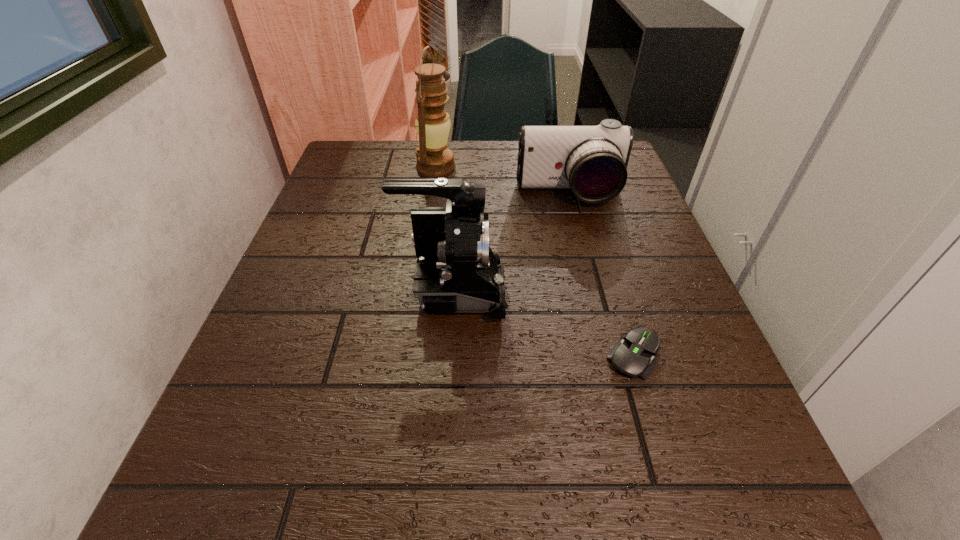
The height and width of the screenshot is (540, 960). Identify the location of the tallest object. (434, 159).

Find the location of a particular element. Image resolution: width=960 pixels, height=540 pixels. the third shortest object is located at coordinates (456, 269).

At what (x,y) coordinates should I click in order to perform the action: click on the second nearest object. Please return your answer as a coordinate pair (x, y). The width and height of the screenshot is (960, 540). Looking at the image, I should click on (456, 269).

Locate an element on the screen. This screenshot has width=960, height=540. the farther camcorder is located at coordinates (592, 161).

Locate an element on the screen. The width and height of the screenshot is (960, 540). the right camcorder is located at coordinates (592, 161).

Image resolution: width=960 pixels, height=540 pixels. In order to click on the shortest object in this screenshot , I will do `click(632, 356)`.

This screenshot has height=540, width=960. I want to click on the nearest object, so click(632, 356).

This screenshot has height=540, width=960. In order to click on blank space located 0.150m on the right of the oil lamp in this screenshot , I will do `click(512, 167)`.

Find the location of a particular element. The width and height of the screenshot is (960, 540). vacant area located on the lens mount of the left camcorder is located at coordinates (557, 292).

This screenshot has width=960, height=540. Find the location of `blank space located on the surface of the shorter camcorder`. blank space located on the surface of the shorter camcorder is located at coordinates (581, 239).